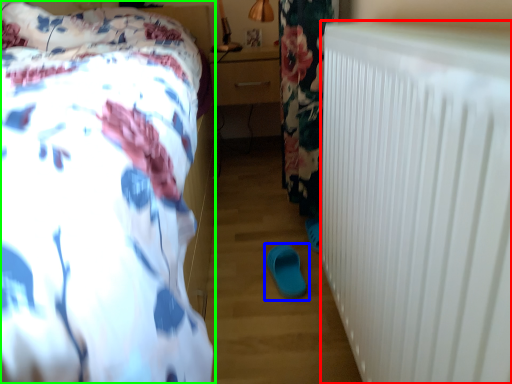
Question: Considering the real-world distances, which object is closest to radiator (highlighted by a red box)? footwear (highlighted by a blue box) or bed (highlighted by a green box).

Choices:
 (A) footwear
 (B) bed

Answer: (B)